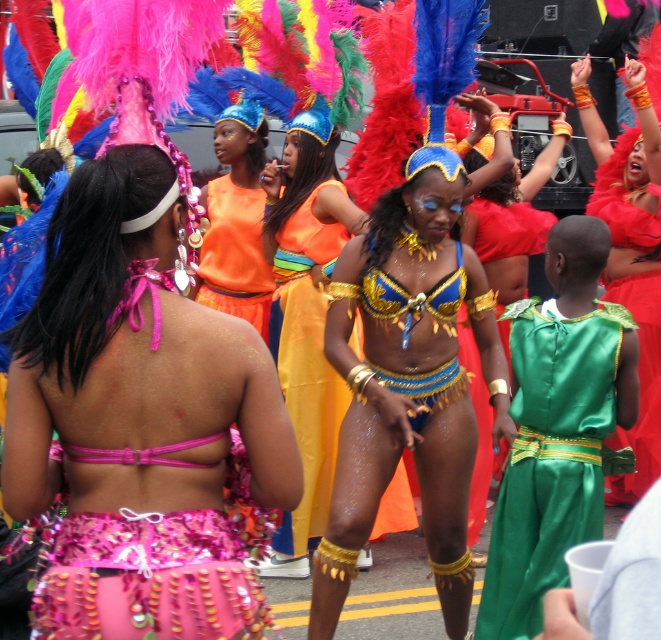
Question: Among these points, which one is nearest to the camera?

Choices:
 (A) (36, 417)
 (B) (229, 257)
 (C) (369, 401)
 (D) (547, 442)

Answer: (A)

Question: Is shiny gold bikini at center below orange fabric skirt at center?

Choices:
 (A) no
 (B) yes

Answer: (B)

Question: Does shiny blue bikini at center have a lesser width compared to orange fabric skirt at center?

Choices:
 (A) no
 (B) yes

Answer: (A)

Question: Among these objects, which one is nearest to the camera?

Choices:
 (A) orange fabric skirt at center
 (B) green satin dress at lower right
 (C) shiny pink bikini top at center
 (D) shiny blue bikini at center

Answer: (C)

Question: Which point is closer to the camera?

Choices:
 (A) shiny gold bikini at center
 (B) shiny pink bikini top at center
 (C) green satin dress at lower right
 (D) shiny blue bikini at center

Answer: (B)

Question: Can you confirm if shiny blue bikini at center is wider than shiny red feather headdress at center?

Choices:
 (A) yes
 (B) no

Answer: (A)